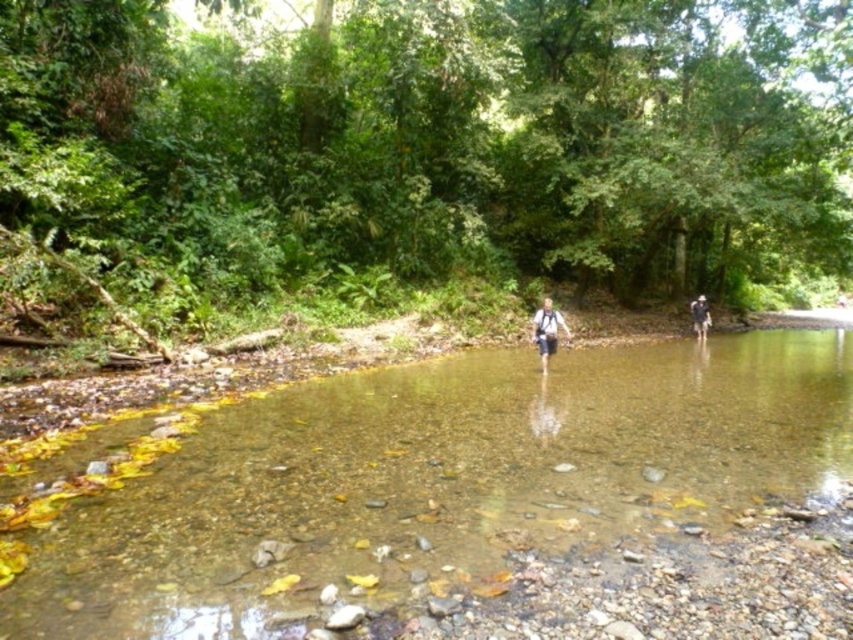
Does white fabric backpack at center lie behind dark blue backpack at right?

No, it is in front of dark blue backpack at right.

Who is taller, white fabric backpack at center or dark blue backpack at right?

dark blue backpack at right

Is point (549, 312) positioned after point (703, 316)?

No, it is not.

Locate an element on the screen. The height and width of the screenshot is (640, 853). white fabric backpack at center is located at coordinates (547, 330).

Based on the photo, is green leafy forest at center closer to camera compared to dark blue backpack at right?

That is True.

Does point (183, 109) come closer to viewer compared to point (701, 332)?

Yes, point (183, 109) is in front of point (701, 332).

Is point (88, 250) behind point (697, 307)?

That is False.

I want to click on green leafy forest at center, so click(x=418, y=154).

Is point (3, 248) farther from viewer compared to point (746, 422)?

Yes, point (3, 248) is behind point (746, 422).

Which is behind, point (22, 124) or point (514, 378)?

Positioned behind is point (22, 124).

Is point (421, 86) positioned before point (259, 524)?

That is False.

Where is `green leafy forest at center`? This screenshot has width=853, height=640. green leafy forest at center is located at coordinates (418, 154).